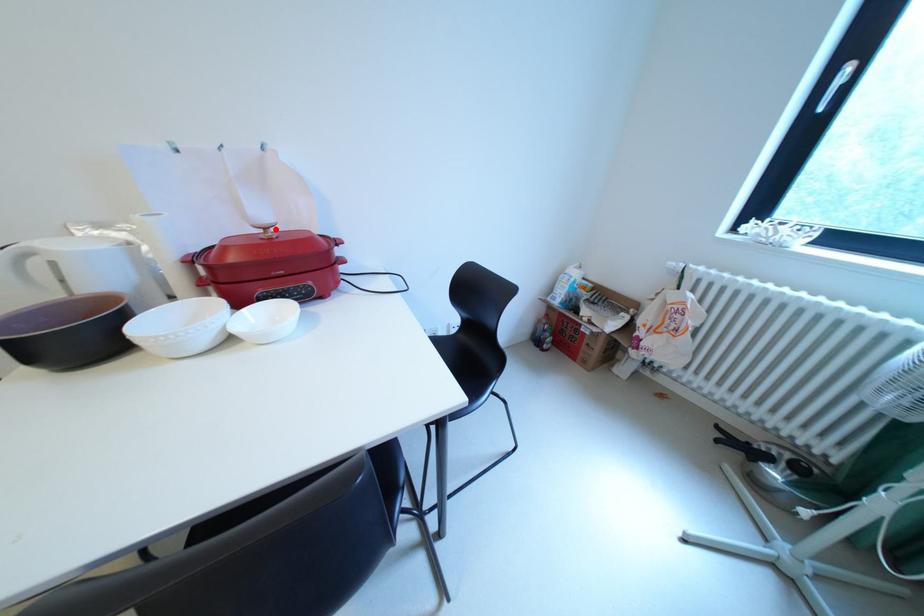
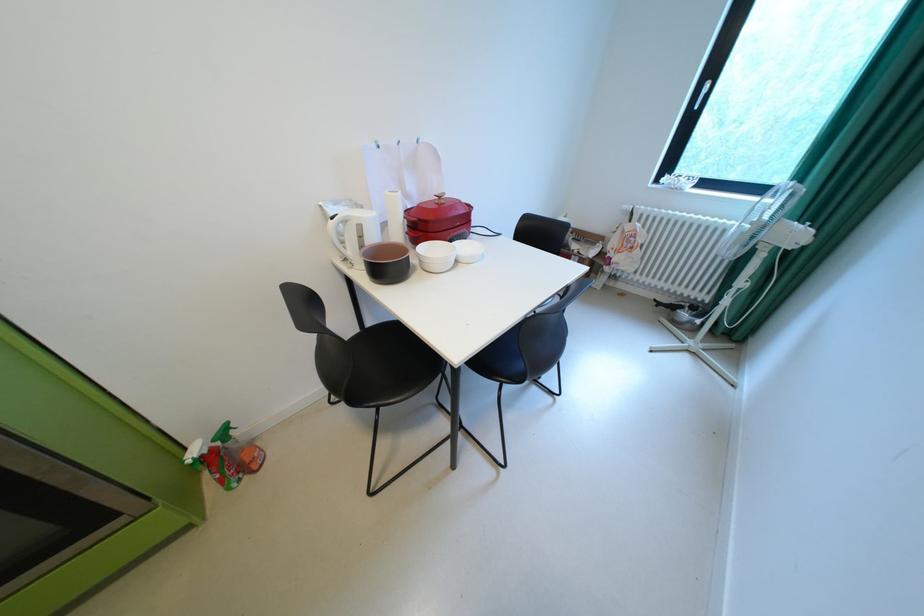
Where in the second image is the point corresponding to the highlighted location from the first image?

(450, 198)